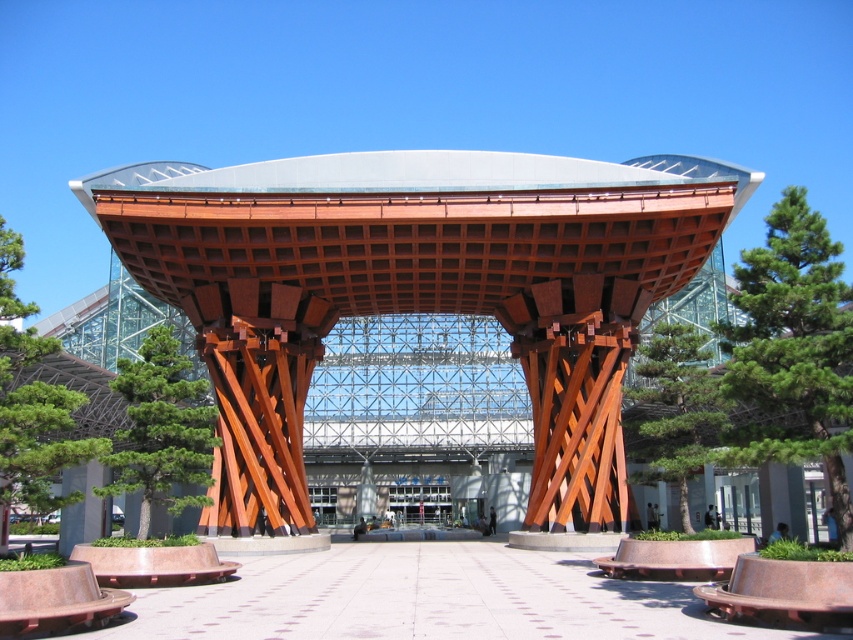
Question: In this image, where is green leafy tree at center located relative to green matte tree at center?

Choices:
 (A) below
 (B) above

Answer: (B)

Question: Does wooden lattice canopy at center lie in front of green leafy tree at center?

Choices:
 (A) no
 (B) yes

Answer: (A)

Question: Which of the following is the closest to the observer?

Choices:
 (A) green matte tree at center
 (B) green leafy tree at center
 (C) wooden lattice canopy at center

Answer: (B)

Question: Which object is closer to the camera taking this photo?

Choices:
 (A) green leafy tree at left
 (B) green leafy tree at center
 (C) green matte tree at center

Answer: (A)

Question: Is green matte tree at center positioned in front of green textured tree at center?

Choices:
 (A) no
 (B) yes

Answer: (B)

Question: Which object is closer to the camera taking this photo?

Choices:
 (A) green textured tree at center
 (B) wooden lattice canopy at center
 (C) green leafy tree at left
 (D) green leafy tree at center

Answer: (C)